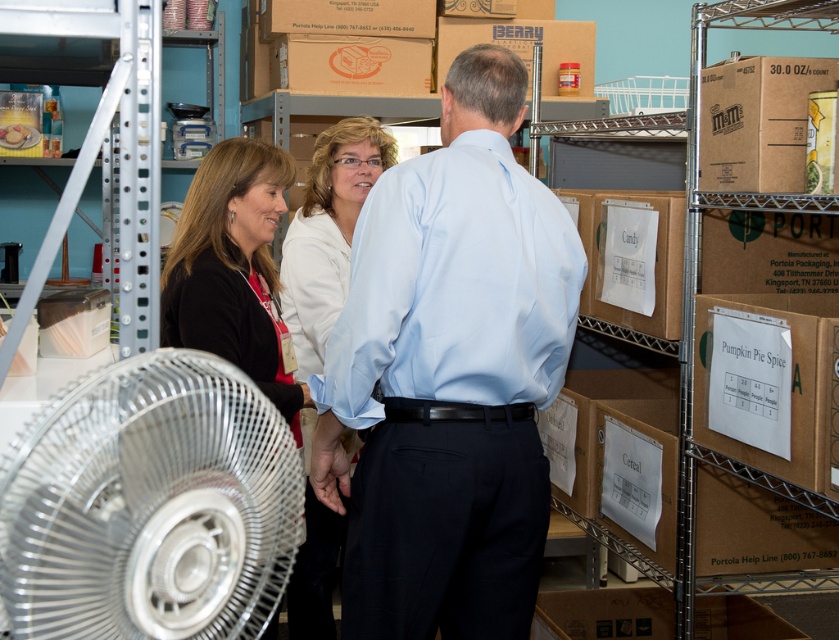
You are standing in the storage area and need to locate the white matte shirt at center. According to the coordinates given, where should you look to find it?

The white matte shirt at center is located at the coordinates point (327, 232).

You are an employee in the warehouse and need to place a new label on either the light blue shirt at center or the brown cardboard box at upper center. Which object should you choose if you want to place the label at a height that is easier to reach for most adults?

The brown cardboard box at upper center should be chosen because the light blue shirt at center has a greater height, making the box a better option for easier reach.